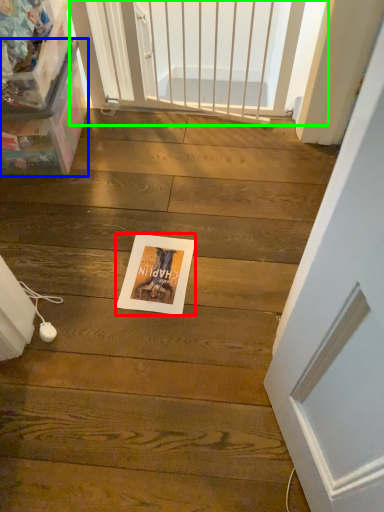
Question: Which object is positioned farthest from postcard (highlighted by a red box)? Select from box (highlighted by a blue box) and screen door (highlighted by a green box).

Choices:
 (A) box
 (B) screen door

Answer: (B)